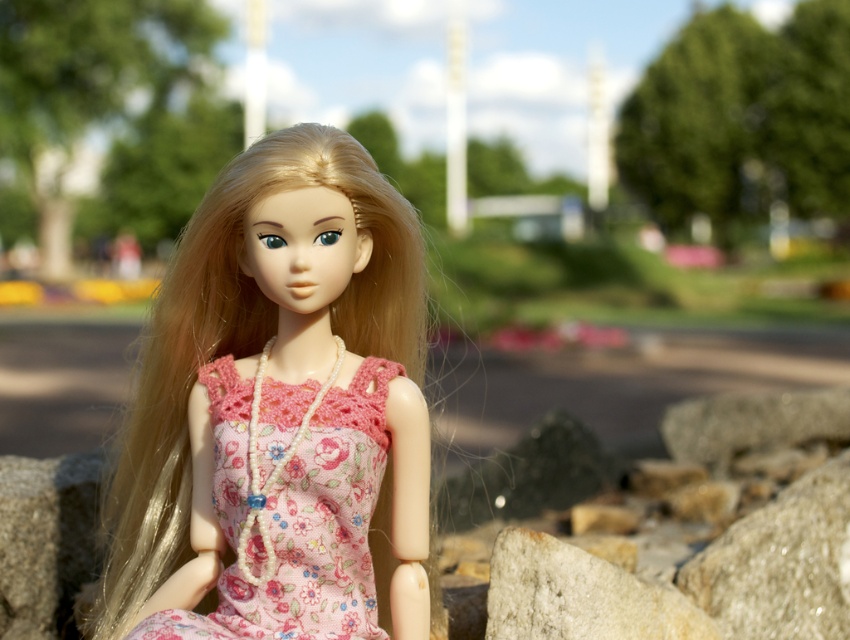
You are a photographer trying to capture the doll from a low angle. You notice two gray stones in the frame. Which gray stone, the gray rough stone at lower right or the gray granite stone at lower left, is positioned lower in the image?

The gray rough stone at lower right is positioned lower in the image than the gray granite stone at lower left.

You are a photographer setting up a shot of the doll. You need to place a small prop between the gray rough stone at lower right and the gray granite stone at lower left. Which stone should the prop be closer to if you want it to appear larger in the photo?

The prop should be placed closer to the gray rough stone at lower right because it is shorter than the gray granite stone at lower left, so positioning it near the shorter stone would make it appear larger in comparison.

You are a photographer setting up a shot of the doll. You notice two stones in the foreground. To ensure both gray rough stone at lower right and gray granite stone at lower left are visible in the frame, which stone should you position closer to the camera?

You should position the gray rough stone at lower right closer to the camera because the gray granite stone at lower left is behind it, so moving the gray rough stone at lower right forward will keep both stones visible in the frame.